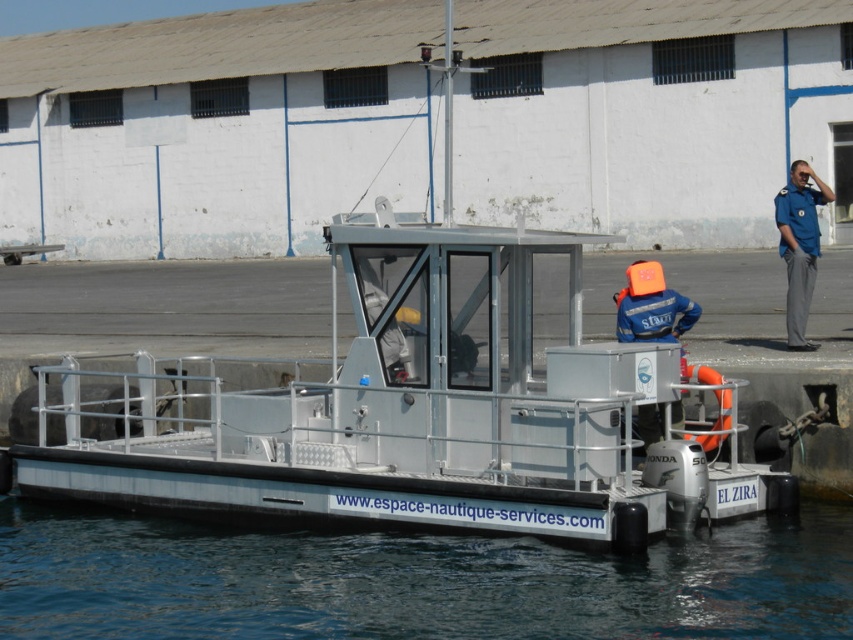
Question: Which of the following is the farthest from the observer?

Choices:
 (A) (125, 531)
 (B) (672, 422)
 (C) (720, 428)
 (D) (798, 284)

Answer: (D)

Question: Does orange foam helmet at center have a larger size compared to blue uniform at upper right?

Choices:
 (A) no
 (B) yes

Answer: (A)

Question: Is blue water at lower center wider than orange foam helmet at center?

Choices:
 (A) no
 (B) yes

Answer: (B)

Question: Which point is closer to the camera?

Choices:
 (A) click(x=805, y=276)
 (B) click(x=286, y=548)
 (C) click(x=717, y=376)

Answer: (C)

Question: Which object is positioned closest to the blue water at lower center?

Choices:
 (A) blue uniform at upper right
 (B) orange rubber life jacket at right
 (C) orange foam helmet at center

Answer: (B)

Question: Does blue water at lower center have a lesser width compared to orange foam helmet at center?

Choices:
 (A) no
 (B) yes

Answer: (A)